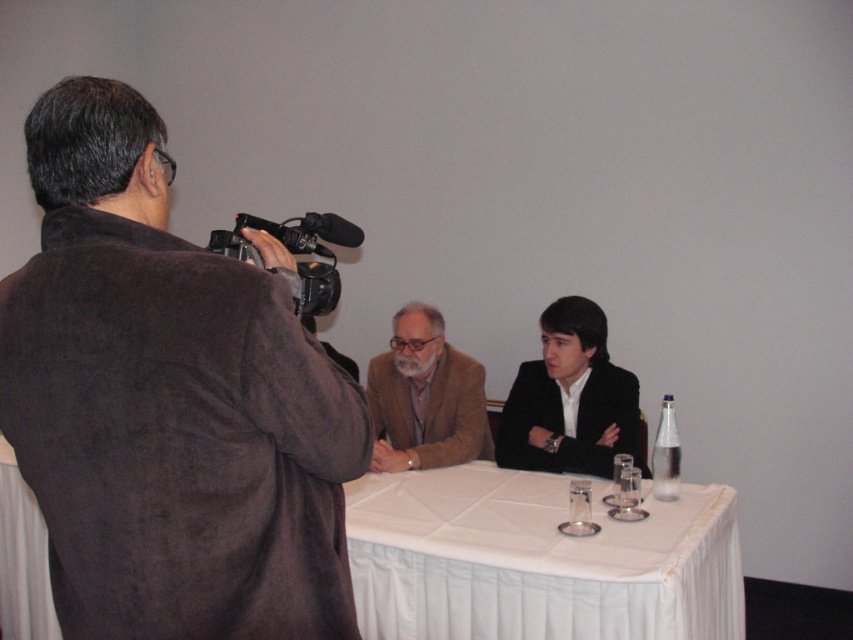
You are a photographer trying to capture a closeup of both the brown suede jacket at left and the clear glass bottle at right in the scene. Given that your camera has a maximum focus range of 1.5 meters, will you be able to capture both objects in focus simultaneously?

The brown suede jacket at left and clear glass bottle at right are 1.71 meters apart from each other. Since the distance between them exceeds the camera maximum focus range of 1.5 meters, you will not be able to capture both objects in focus simultaneously.

Looking at this image, what is located at the coordinates point (433, 410) in the image?

The brown woolen suit at center is located at point (433, 410).

You are a photographer trying to position two lights for a photo shoot. You have two points marked on the image where you need to place the lights. The points are labeled as point 1 at coordinates point (456, 374) and point 2 at coordinates point (669, 467). According to the scene, which point is positioned further back in the image?

Point (456, 374) is behind point (669, 467), so point 1 is positioned further back in the image.